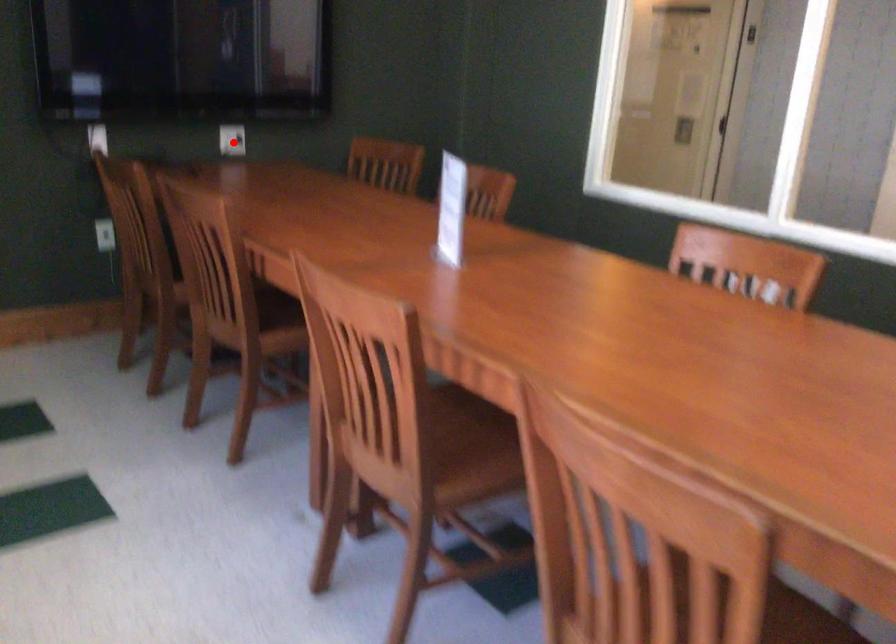
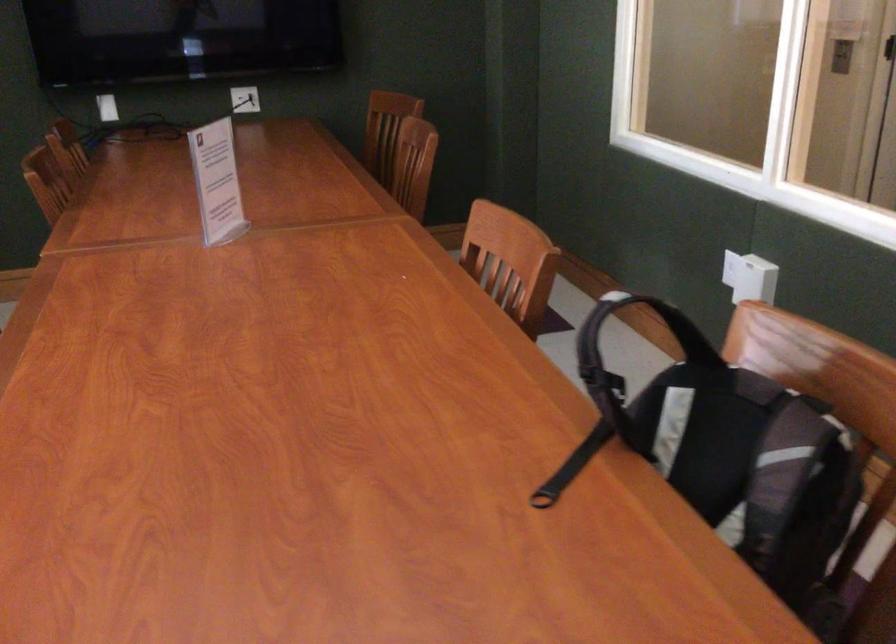
The point at the highlighted location is marked in the first image. Where is the corresponding point in the second image?

(245, 99)